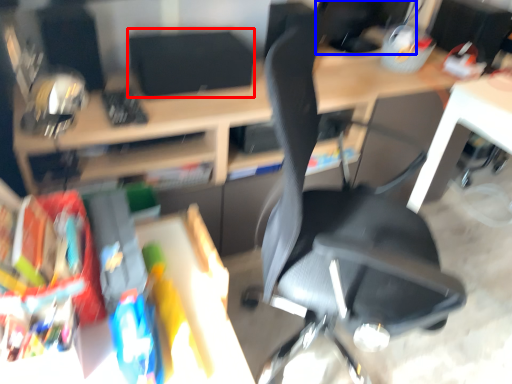
Question: Among these objects, which one is farthest to the camera, computer monitor (highlighted by a red box) or computer monitor (highlighted by a blue box)?

Choices:
 (A) computer monitor
 (B) computer monitor

Answer: (B)